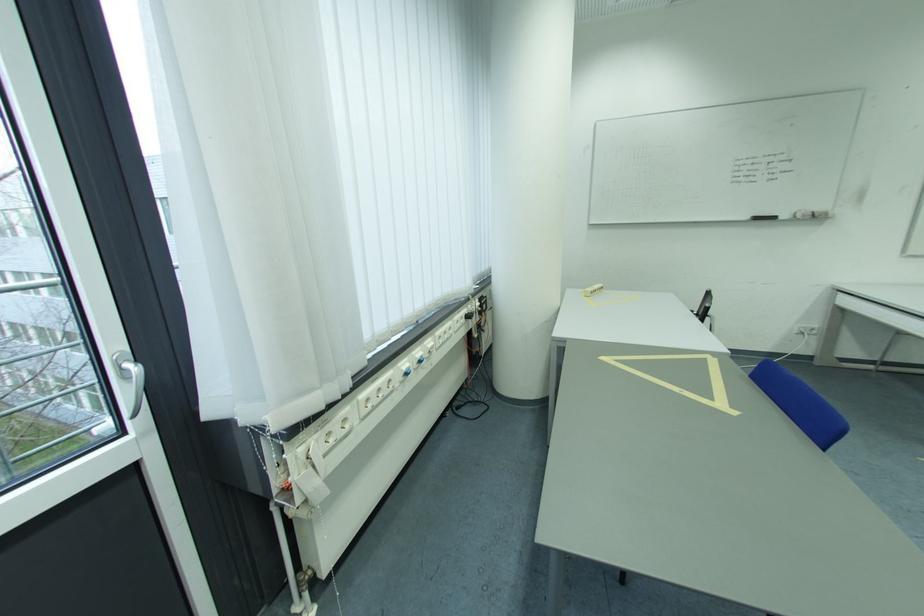
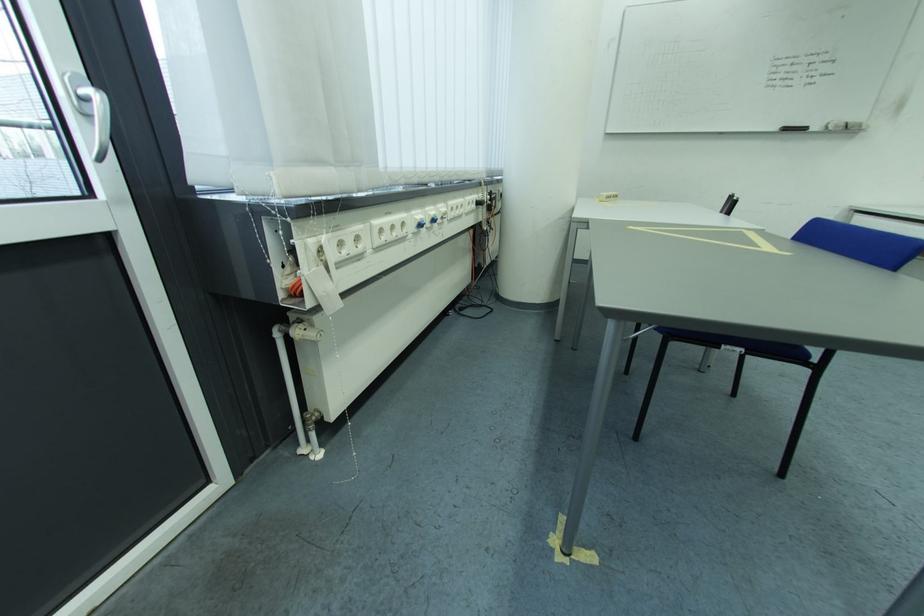
Question: I am providing you with two images of the same scene from different viewpoints. After the viewpoint changes to image2, which objects are now occluded?

Choices:
 (A) beaded pull chain
 (B) white power socket
 (C) blue light switch
 (D) none of these

Answer: (D)